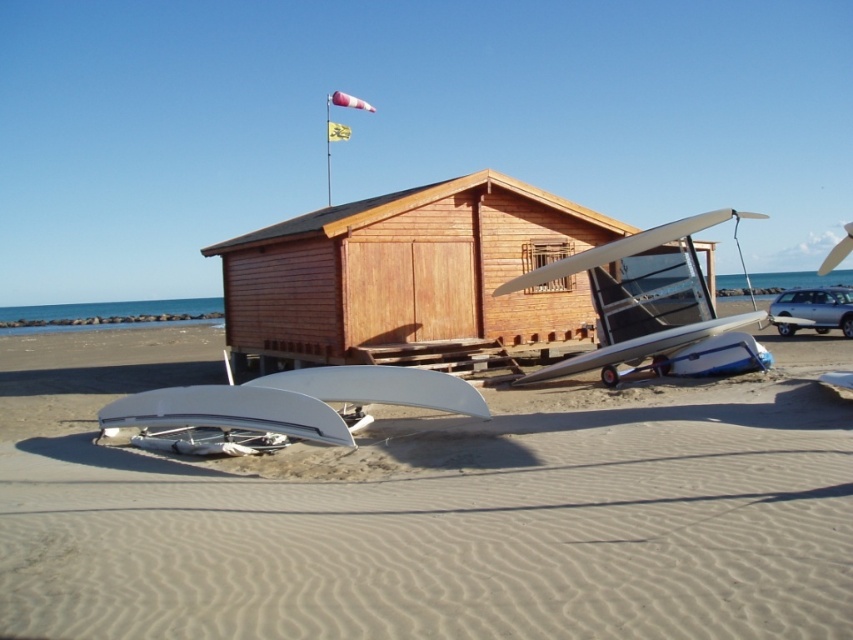
Question: Which of the following is the farthest from the observer?

Choices:
 (A) metallic silver airplane at center
 (B) white glossy wing at lower center

Answer: (A)

Question: Does white matte surfboard at center have a greater width compared to metallic silver airplane at center?

Choices:
 (A) yes
 (B) no

Answer: (B)

Question: Where is white matte surfboard at center located in relation to white glossy wing at lower center in the image?

Choices:
 (A) below
 (B) above

Answer: (A)

Question: Which of these objects is positioned farthest from the metallic silver airplane at center?

Choices:
 (A) white matte surfboard at center
 (B) white glossy wing at lower center

Answer: (B)

Question: Which of the following is the farthest from the observer?

Choices:
 (A) (369, 420)
 (B) (181, 374)
 (C) (677, 300)

Answer: (B)

Question: Can you confirm if white matte surfboard at center is positioned to the left of white glossy wing at lower center?

Choices:
 (A) no
 (B) yes

Answer: (A)